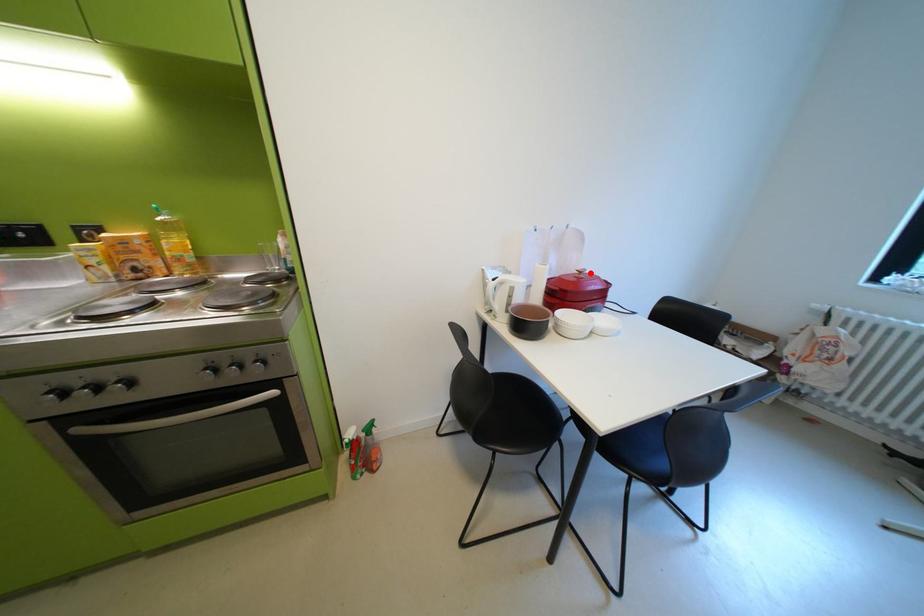
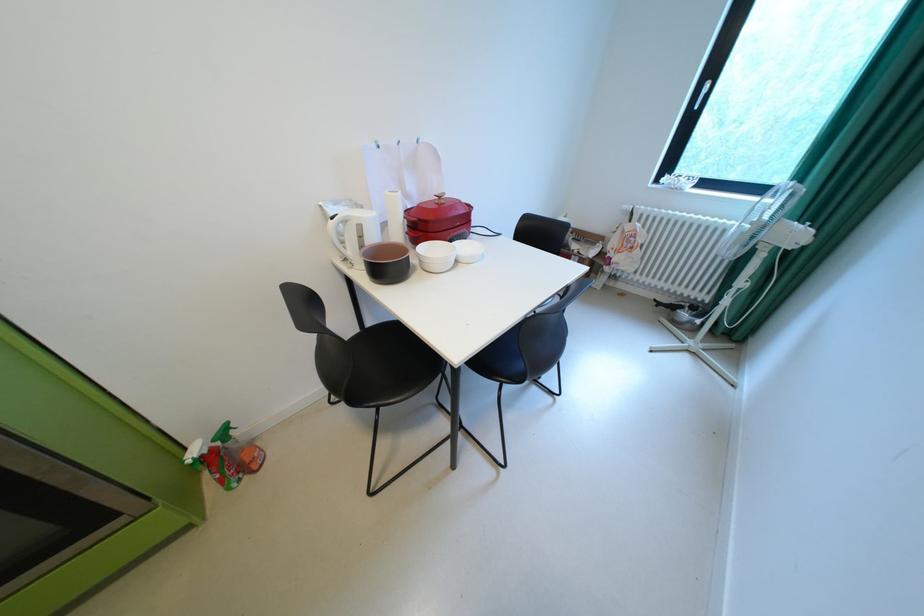
Question: I am providing you with two images of the same scene from different viewpoints. In image1, a red point is highlighted. Considering the same 3D point in image2, which of the following is correct?

Choices:
 (A) It is closer
 (B) It is farther

Answer: (A)